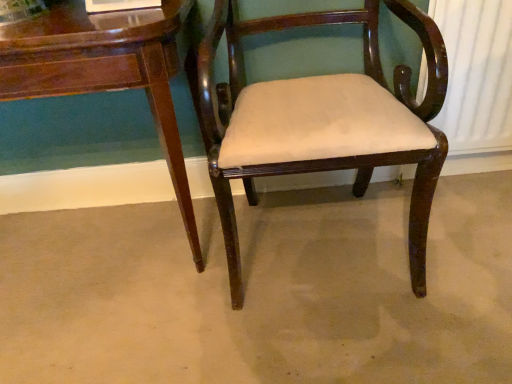
Question: Considering the positions of glossy wood table at lower left and mahogany wood chair at center in the image, is glossy wood table at lower left bigger or smaller than mahogany wood chair at center?

Choices:
 (A) small
 (B) big

Answer: (B)

Question: Looking at their shapes, would you say glossy wood table at lower left is wider or thinner than mahogany wood chair at center?

Choices:
 (A) thin
 (B) wide

Answer: (A)

Question: Which object is the closest to the brown wood chair at center?

Choices:
 (A) mahogany wood chair at center
 (B) glossy wood table at lower left

Answer: (A)

Question: Which object is the closest to the mahogany wood chair at center?

Choices:
 (A) glossy wood table at lower left
 (B) brown wood chair at center

Answer: (A)